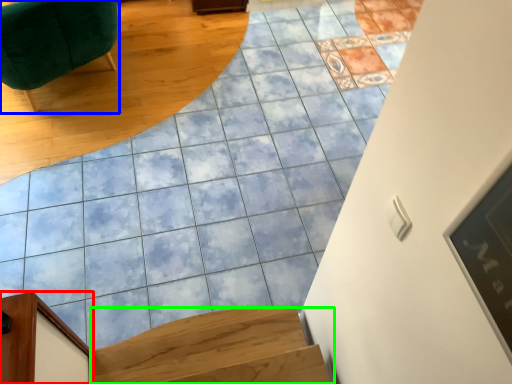
Question: Considering the real-world distances, which object is farthest from furniture (highlighted by a red box)? furniture (highlighted by a blue box) or stairs (highlighted by a green box)?

Choices:
 (A) furniture
 (B) stairs

Answer: (A)